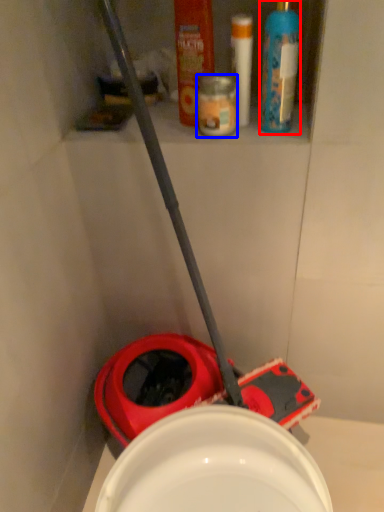
Question: Which object is further to the camera taking this photo, cleaning product (highlighted by a red box) or toiletry (highlighted by a blue box)?

Choices:
 (A) cleaning product
 (B) toiletry

Answer: (B)